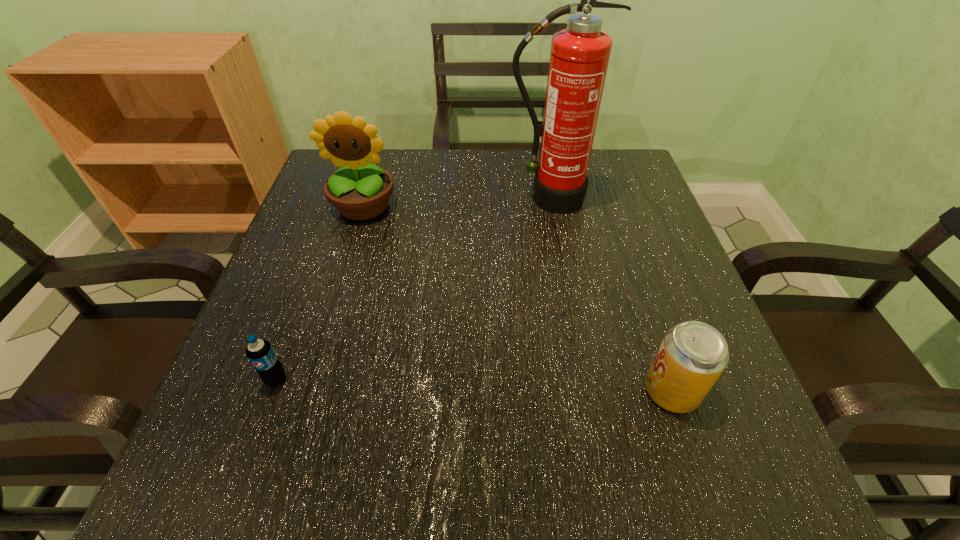
Image resolution: width=960 pixels, height=540 pixels. In the image, there is a desktop. What are the coordinates of `vacant space at the left edge` in the screenshot? It's located at (334, 274).

Locate an element on the screen. The width and height of the screenshot is (960, 540). vacant area at the right edge of the desktop is located at coordinates (672, 302).

The image size is (960, 540). I want to click on vacant region at the near left corner of the desktop, so click(x=196, y=477).

This screenshot has width=960, height=540. I want to click on vacant region at the far right corner, so click(631, 181).

The width and height of the screenshot is (960, 540). I want to click on blank region between the left soda bottle and the third shortest object, so (x=320, y=293).

You are a GUI agent. You are given a task and a screenshot of the screen. Output one action in this format:
    pyautogui.click(x=<x>, y=<y>)
    Task: Click on the free point between the sunflower and the second shortest object
    The width and height of the screenshot is (960, 540).
    Given the screenshot: What is the action you would take?
    pyautogui.click(x=517, y=299)

Locate an element on the screen. The height and width of the screenshot is (540, 960). free space that is in between the second tallest object and the tallest object is located at coordinates (456, 202).

You are a GUI agent. You are given a task and a screenshot of the screen. Output one action in this format:
    pyautogui.click(x=<x>, y=<y>)
    Task: Click on the unoccupied position between the fire extinguisher and the shortest object
    
    Given the screenshot: What is the action you would take?
    pyautogui.click(x=413, y=289)

Locate an element on the screen. This screenshot has height=540, width=960. free space between the second tallest object and the shorter soda bottle is located at coordinates (320, 293).

I want to click on free space that is in between the fire extinguisher and the right soda bottle, so [610, 295].